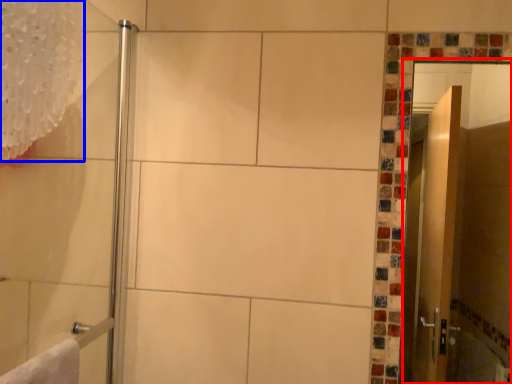
Question: Which point is closer to the camera, screen door (highlighted by a red box) or shower curtain (highlighted by a blue box)?

Choices:
 (A) screen door
 (B) shower curtain

Answer: (B)